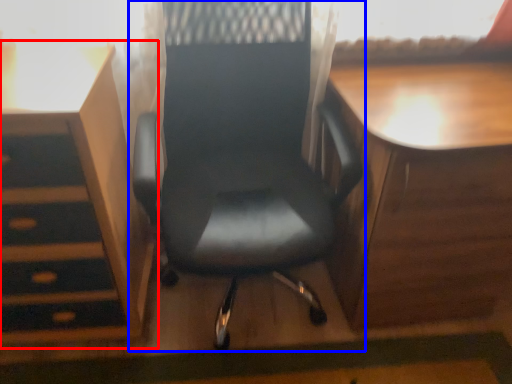
Question: Among these objects, which one is farthest to the camera, vanity (highlighted by a red box) or chair (highlighted by a blue box)?

Choices:
 (A) vanity
 (B) chair

Answer: (A)